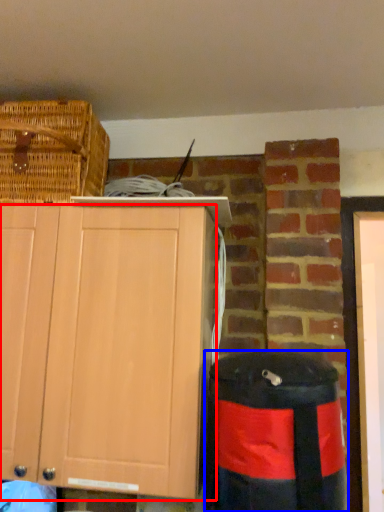
Question: Among these objects, which one is nearest to the camera, cabinetry (highlighted by a red box) or trash bin/can (highlighted by a blue box)?

Choices:
 (A) cabinetry
 (B) trash bin/can

Answer: (B)